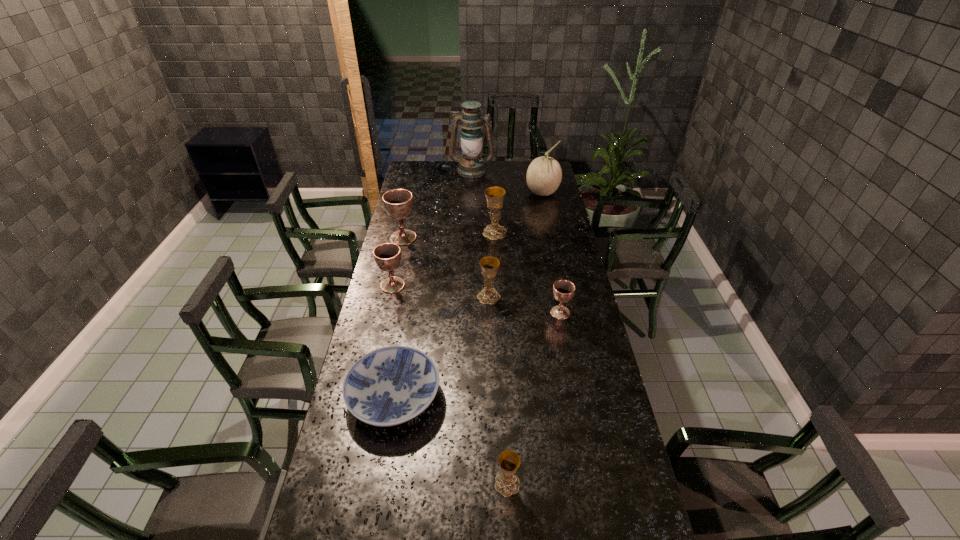
Identify which object is located as the fourth nearest to the third nearest object. Please provide its 2D coordinates. Your answer should be formatted as a tuple, i.e. [(x, y)], where the tuple contains the x and y coordinates of a point satisfying the conditions above.

[(387, 256)]

Locate which object is the second closest to the blue plate. Please provide its 2D coordinates. Your answer should be formatted as a tuple, i.e. [(x, y)], where the tuple contains the x and y coordinates of a point satisfying the conditions above.

[(489, 264)]

Select which chalice is the sixth closest to the eighth shortest object. Please provide its 2D coordinates. Your answer should be formatted as a tuple, i.e. [(x, y)], where the tuple contains the x and y coordinates of a point satisfying the conditions above.

[(507, 483)]

Locate an element on the screen. The width and height of the screenshot is (960, 540). the third closest chalice to the second smallest gold chalice is located at coordinates (494, 195).

Find the location of `gold chalice object that ranks as the closest to the second nearest brown chalice`. gold chalice object that ranks as the closest to the second nearest brown chalice is located at coordinates (489, 264).

The image size is (960, 540). I want to click on gold chalice that stands as the third closest to the tallest object, so click(x=507, y=483).

Locate which brown chalice is the closest to the farthest brown chalice. Please provide its 2D coordinates. Your answer should be formatted as a tuple, i.e. [(x, y)], where the tuple contains the x and y coordinates of a point satisfying the conditions above.

[(387, 256)]

Identify the location of brown chalice that is the closest to the second nearest brown chalice. Image resolution: width=960 pixels, height=540 pixels. (398, 203).

Find the location of a particular element. This screenshot has height=540, width=960. vacant area that satisfies the following two spatial constraints: 1. on the front side of the farthest gold chalice; 2. on the right side of the tallest object is located at coordinates (470, 233).

Find the location of a particular element. The width and height of the screenshot is (960, 540). free space that satisfies the following two spatial constraints: 1. on the front side of the second farthest brown chalice; 2. on the right side of the smallest gold chalice is located at coordinates (348, 484).